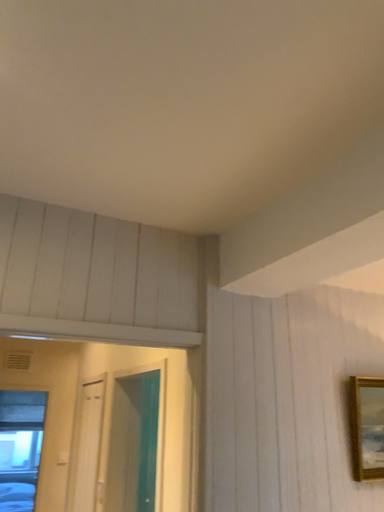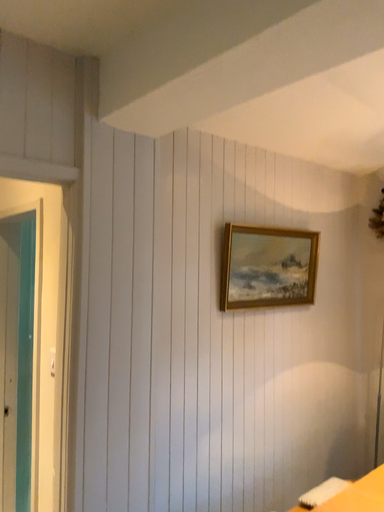
Question: Which way did the camera rotate in the video?

Choices:
 (A) rotated right
 (B) rotated left

Answer: (A)